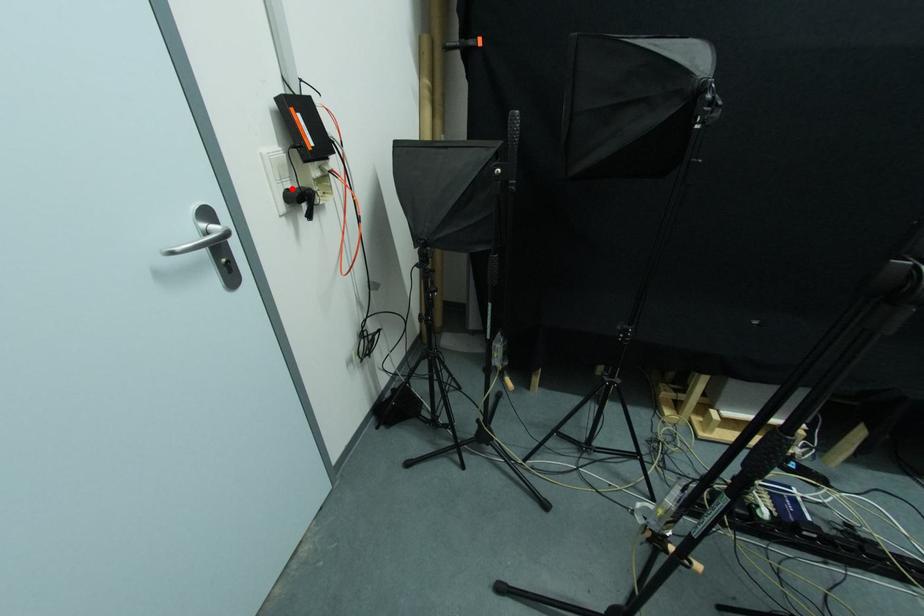
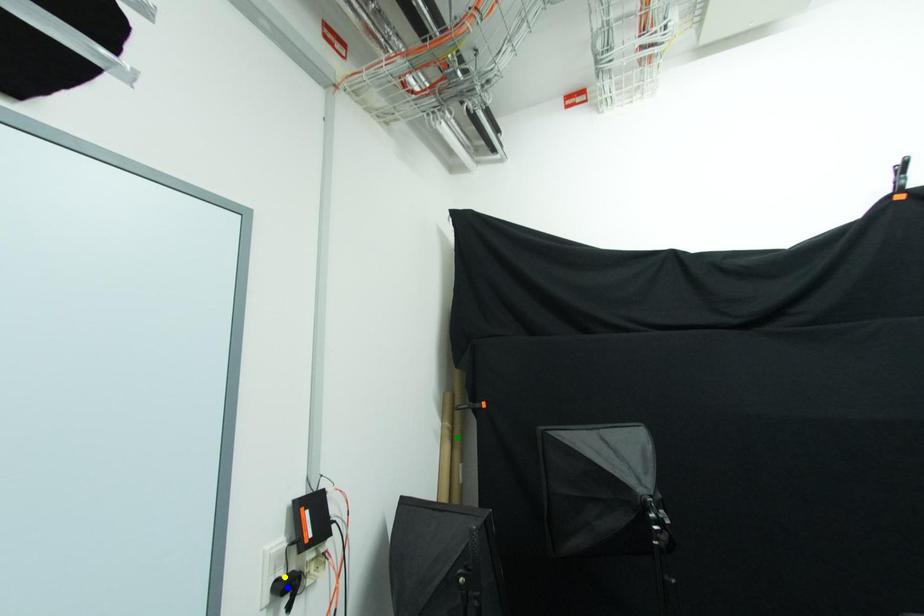
Question: I am providing you with two images of the same scene from different viewpoints. A red point is marked on the first image. You are given multiple points on the second image. Can you choose the point in image 2 that corresponds to the point in image 1?

Choices:
 (A) green point
 (B) blue point
 (C) yellow point

Answer: (C)